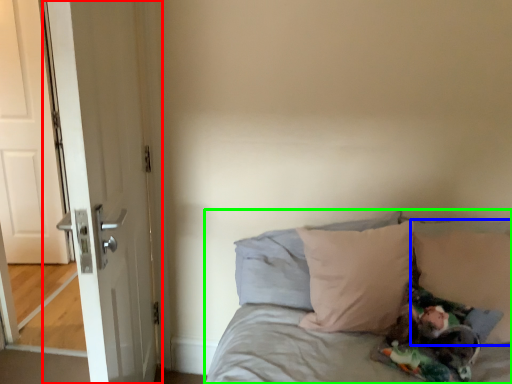
Question: Based on their relative distances, which object is farther from door (highlighted by a red box)? Choose from pillow (highlighted by a blue box) and bed (highlighted by a green box).

Choices:
 (A) pillow
 (B) bed

Answer: (A)